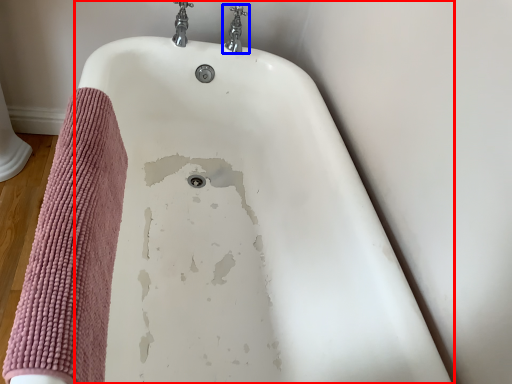
Question: Among these objects, which one is farthest to the camera, bathtub (highlighted by a red box) or tap (highlighted by a blue box)?

Choices:
 (A) bathtub
 (B) tap

Answer: (B)